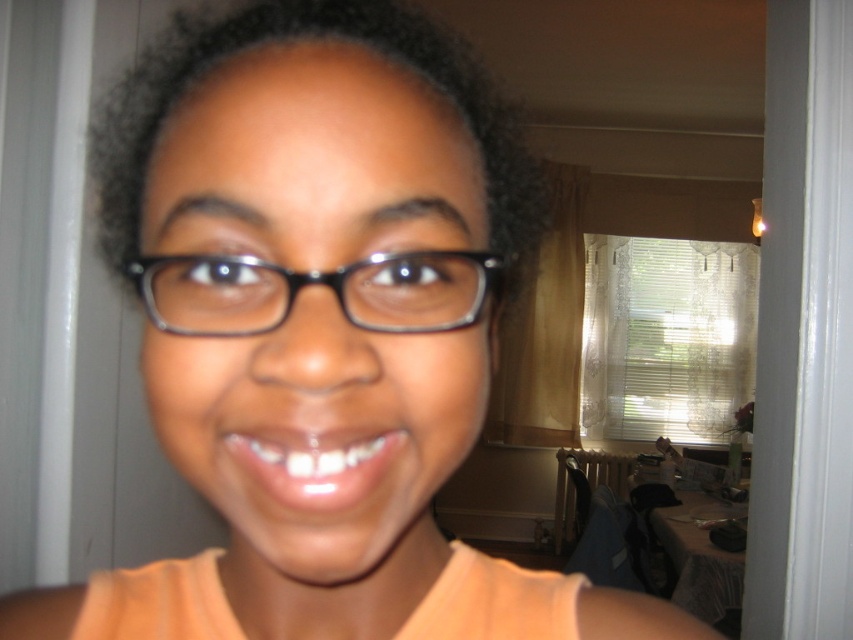
I want to click on dark curly hair at center, so click(x=296, y=40).